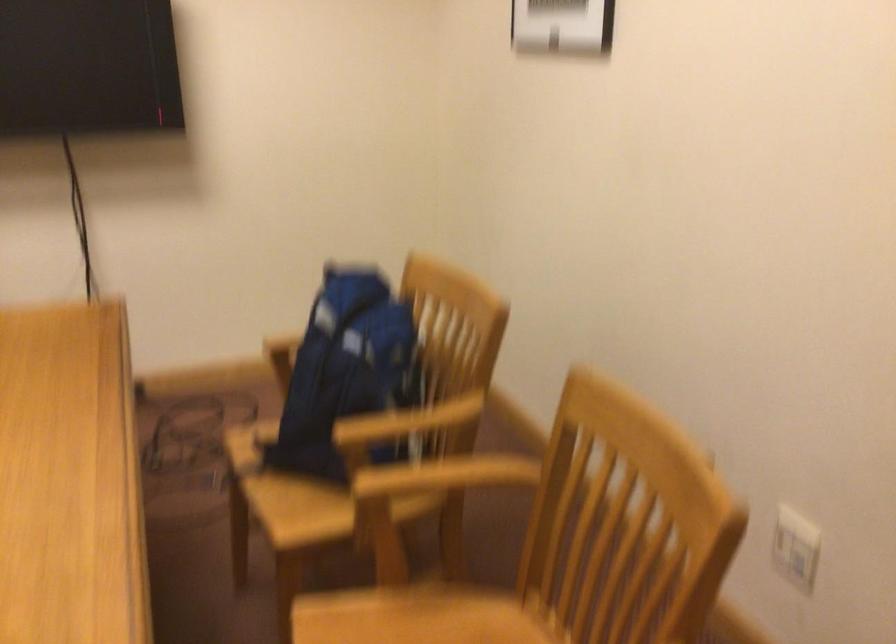
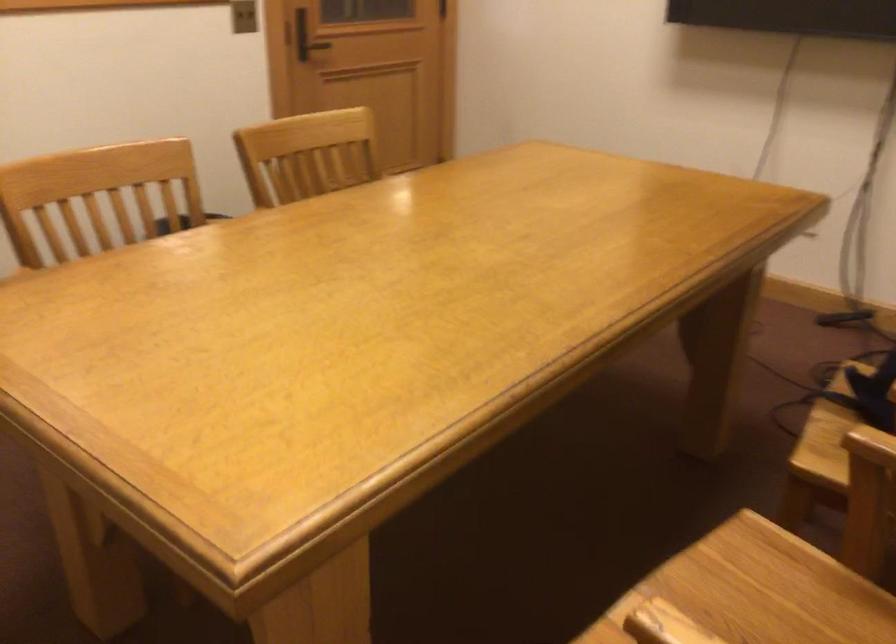
Question: How did the camera likely rotate?

Choices:
 (A) Left
 (B) Right
 (C) Up
 (D) Down

Answer: (A)